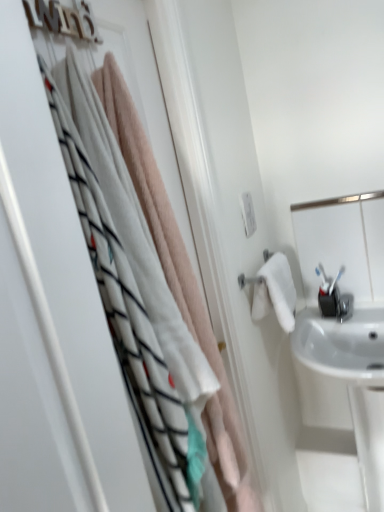
Question: Is white glossy mirror at upper right oriented away from white glossy sink at right?

Choices:
 (A) yes
 (B) no

Answer: (B)

Question: From the image's perspective, would you say white glossy mirror at upper right is shown under white glossy sink at right?

Choices:
 (A) yes
 (B) no

Answer: (B)

Question: Does white glossy mirror at upper right have a lesser width compared to white glossy sink at right?

Choices:
 (A) no
 (B) yes

Answer: (B)

Question: Is there a large distance between white glossy mirror at upper right and white glossy sink at right?

Choices:
 (A) yes
 (B) no

Answer: (B)

Question: Is the position of white glossy mirror at upper right less distant than that of white glossy sink at right?

Choices:
 (A) no
 (B) yes

Answer: (A)

Question: In terms of width, does white glossy mirror at upper right look wider or thinner when compared to white glossy sink at right?

Choices:
 (A) thin
 (B) wide

Answer: (A)

Question: Is white glossy mirror at upper right in front of or behind white glossy sink at right in the image?

Choices:
 (A) front
 (B) behind

Answer: (B)

Question: From a real-world perspective, relative to white glossy sink at right, is white glossy mirror at upper right vertically above or below?

Choices:
 (A) above
 (B) below

Answer: (A)

Question: Is white glossy mirror at upper right taller or shorter than white glossy sink at right?

Choices:
 (A) tall
 (B) short

Answer: (B)

Question: Considering the positions of point (1, 37) and point (319, 400), is point (1, 37) closer or farther from the camera than point (319, 400)?

Choices:
 (A) closer
 (B) farther

Answer: (A)

Question: Is soft pink towel at upper left wider or thinner than white glossy sink at right?

Choices:
 (A) thin
 (B) wide

Answer: (A)

Question: Looking at the image, does soft pink towel at upper left seem bigger or smaller compared to white glossy sink at right?

Choices:
 (A) small
 (B) big

Answer: (A)

Question: From the image's perspective, is soft pink towel at upper left above or below white glossy sink at right?

Choices:
 (A) below
 (B) above

Answer: (B)

Question: From the image's perspective, relative to white glossy mirror at upper right, is white glossy sink at right above or below?

Choices:
 (A) below
 (B) above

Answer: (A)

Question: In terms of width, does white glossy sink at right look wider or thinner when compared to white glossy mirror at upper right?

Choices:
 (A) thin
 (B) wide

Answer: (B)